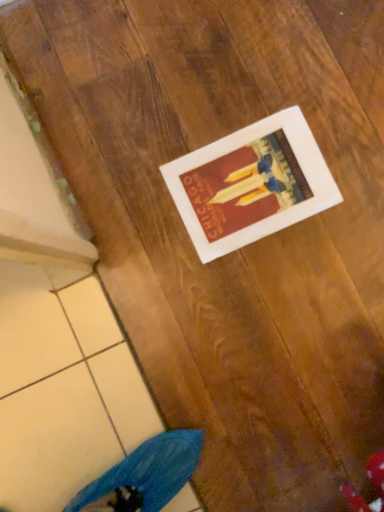
The image size is (384, 512). Find the location of `vacant region in front of white matte picture frame at center`. vacant region in front of white matte picture frame at center is located at coordinates [299, 289].